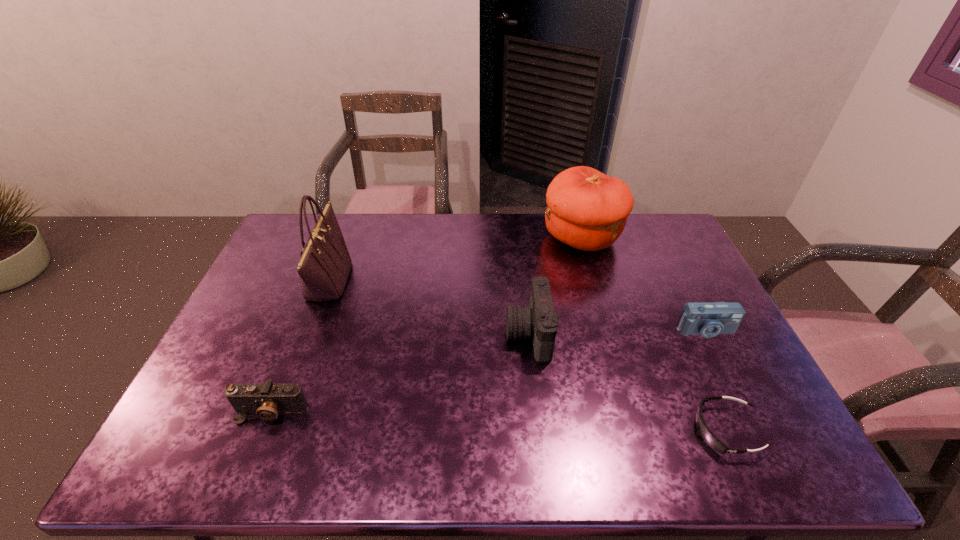
The width and height of the screenshot is (960, 540). I want to click on object that is at the left edge, so [267, 400].

Image resolution: width=960 pixels, height=540 pixels. Identify the location of camera present at the right edge. (708, 319).

Identify the location of goggles at the right edge. This screenshot has height=540, width=960. (709, 438).

The height and width of the screenshot is (540, 960). What are the coordinates of `object at the near right corner` in the screenshot? It's located at (709, 438).

This screenshot has width=960, height=540. In order to click on vacant area at the far edge in this screenshot , I will do `click(414, 215)`.

Find the location of a particular element. This screenshot has height=540, width=960. free space at the near edge is located at coordinates (679, 462).

Locate an element on the screen. This screenshot has width=960, height=540. free space at the left edge is located at coordinates (231, 325).

Find the location of a particular element. vacant space at the right edge is located at coordinates (693, 341).

The image size is (960, 540). I want to click on free space at the near right corner of the desktop, so click(x=724, y=436).

Locate an element on the screen. The width and height of the screenshot is (960, 540). vacant space that is in between the handbag and the fourth shortest object is located at coordinates (429, 307).